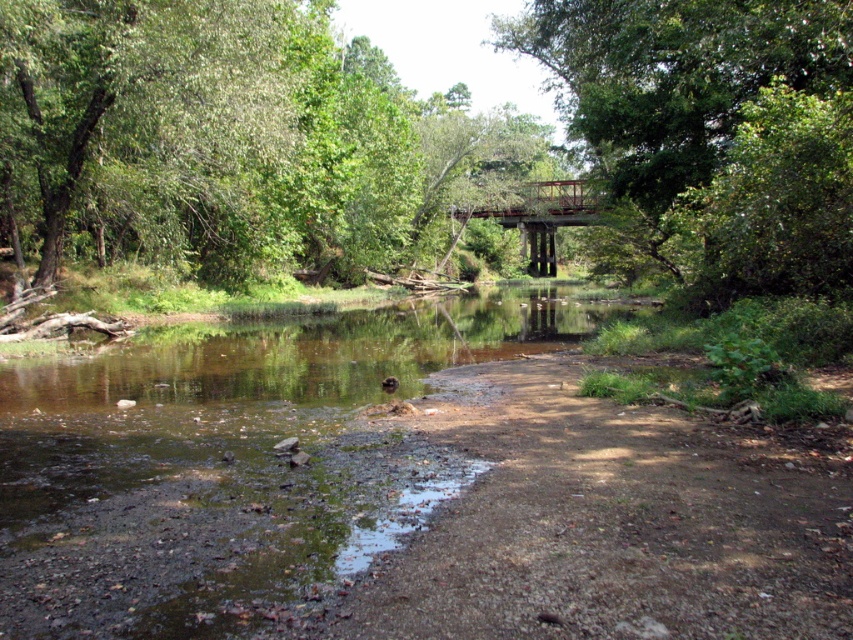
Which is below, brown/muddy water at center or green leafy tree at upper center?

brown/muddy water at center is below.

Consider the image. Does brown/muddy water at center appear under green leafy tree at upper center?

Yes, brown/muddy water at center is below green leafy tree at upper center.

Does point (320, 401) come in front of point (809, 138)?

Yes, point (320, 401) is in front of point (809, 138).

Where is `brown/muddy water at center`? brown/muddy water at center is located at coordinates (231, 464).

Is brown/muddy water at center further to the viewer compared to rusty metal bridge at center?

No, brown/muddy water at center is closer to the viewer.

Is brown/muddy water at center to the right of rusty metal bridge at center from the viewer's perspective?

In fact, brown/muddy water at center is to the left of rusty metal bridge at center.

Where is `brown/muddy water at center`? Image resolution: width=853 pixels, height=640 pixels. brown/muddy water at center is located at coordinates (231, 464).

Is green leafy tree at upper center to the right of rusty metal bridge at center from the viewer's perspective?

Indeed, green leafy tree at upper center is positioned on the right side of rusty metal bridge at center.

Does point (550, 44) lie behind point (518, 212)?

No, it is in front of (518, 212).

This screenshot has height=640, width=853. What are the coordinates of `green leafy tree at upper center` in the screenshot? It's located at (714, 129).